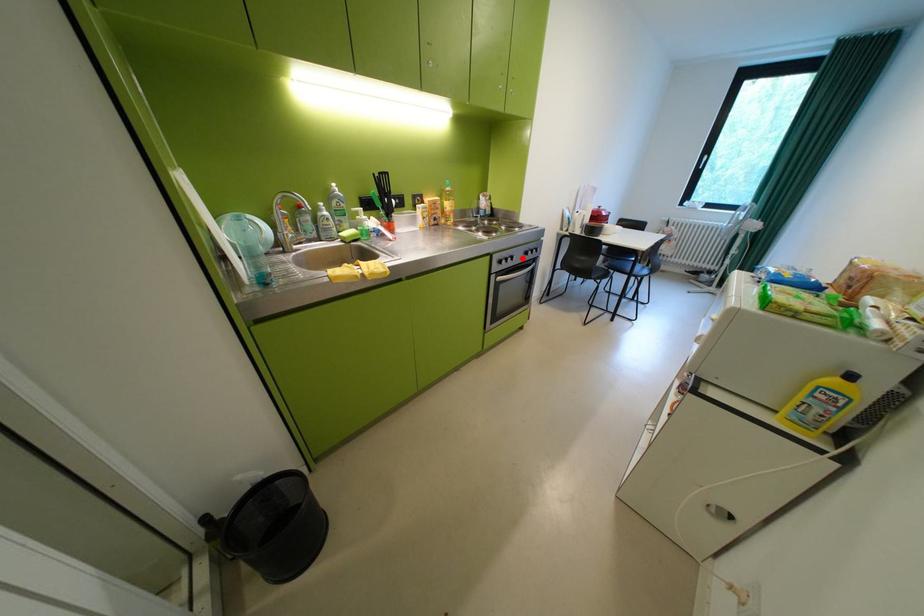
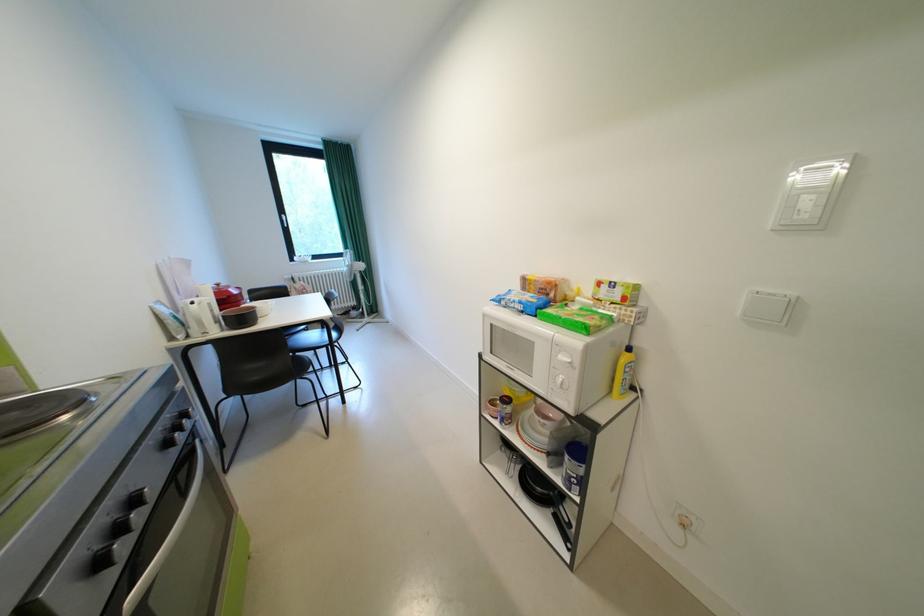
Where in the second image is the point corresponding to the highlighted location from the first image?

(146, 501)